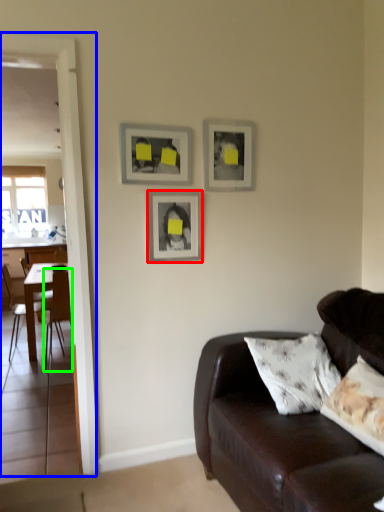
Question: Based on their relative distances, which object is nearer to picture frame (highlighted by a red box)? Choose from glass door (highlighted by a blue box) and chair (highlighted by a green box).

Choices:
 (A) glass door
 (B) chair

Answer: (A)